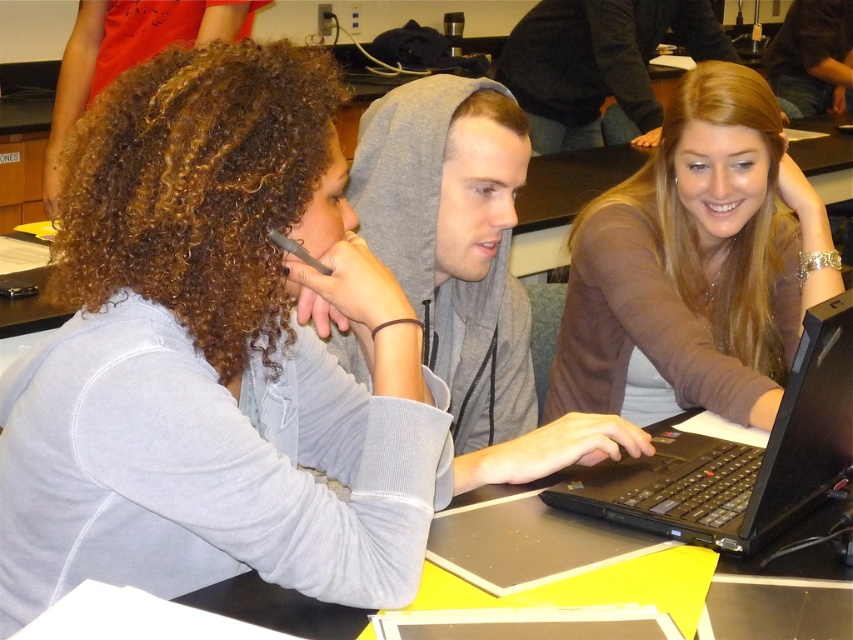
Who is more forward, (750,356) or (498,209)?

Positioned in front is point (498,209).

From the picture: Between matte brown sweater at center and gray hoodie at center, which one is positioned higher?

matte brown sweater at center

Does point (773, 323) come behind point (367, 221)?

Yes, point (773, 323) is farther from viewer.

The width and height of the screenshot is (853, 640). I want to click on matte brown sweater at center, so pos(694,260).

Who is more forward, [451,372] or [608,173]?

Positioned in front is point [451,372].

Can you confirm if gray hoodie at center is positioned to the right of yellow plastic table at center?

Incorrect, gray hoodie at center is not on the right side of yellow plastic table at center.

Does point (445, 164) come in front of point (573, 164)?

Yes, point (445, 164) is closer to viewer.

Where is `gray hoodie at center`? The image size is (853, 640). gray hoodie at center is located at coordinates (466, 268).

Does matte brown sweater at center lie in front of black matte laptop at lower right?

No, matte brown sweater at center is further to the viewer.

Does point (686, 305) come in front of point (718, 474)?

That is False.

Does point (676, 134) come closer to viewer compared to point (672, 528)?

No, (676, 134) is behind (672, 528).

Find the location of a particular element. matte brown sweater at center is located at coordinates (694, 260).